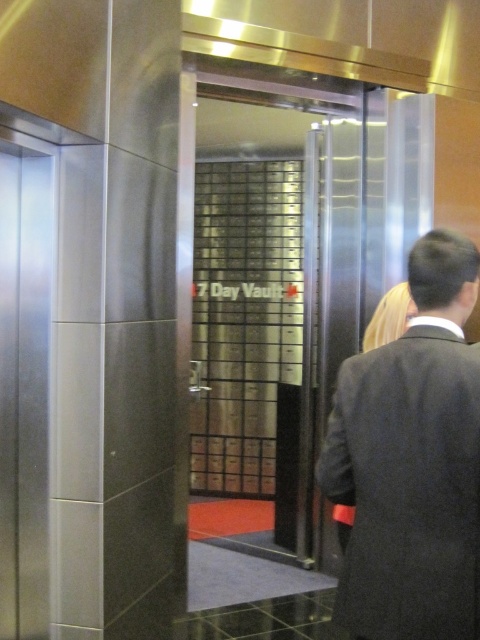
Who is more forward, (323, 262) or (455, 477)?

Positioned in front is point (455, 477).

Does clear glass door at center appear on the left side of dark gray suit at right?

Correct, you'll find clear glass door at center to the left of dark gray suit at right.

Which is behind, point (323, 204) or point (432, 493)?

The point (323, 204) is more distant.

Where is `clear glass door at center`? This screenshot has height=640, width=480. clear glass door at center is located at coordinates (273, 296).